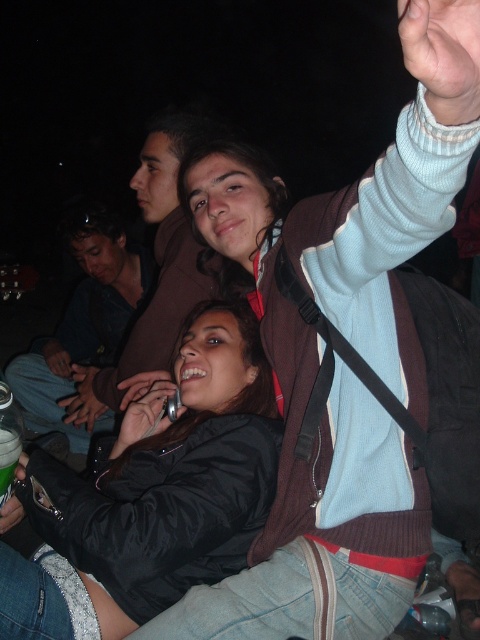
Question: In this image, where is matte black jacket at center located relative to green plastic cup at lower left?

Choices:
 (A) left
 (B) right

Answer: (B)

Question: Is matte black jacket at center positioned in front of dark blue shirt at center?

Choices:
 (A) no
 (B) yes

Answer: (B)

Question: Which of the following is the closest to the observer?

Choices:
 (A) black satin jacket at lower left
 (B) matte black jacket at center

Answer: (B)

Question: Where is black satin jacket at lower left located in relation to green plastic cup at lower left in the image?

Choices:
 (A) right
 (B) left

Answer: (A)

Question: Which of the following is the closest to the observer?

Choices:
 (A) green plastic cup at lower left
 (B) matte brown jacket at upper center
 (C) black satin jacket at lower left

Answer: (C)

Question: Which object is the closest to the black satin jacket at lower left?

Choices:
 (A) matte brown jacket at upper center
 (B) dark blue shirt at center
 (C) matte black jacket at center

Answer: (C)